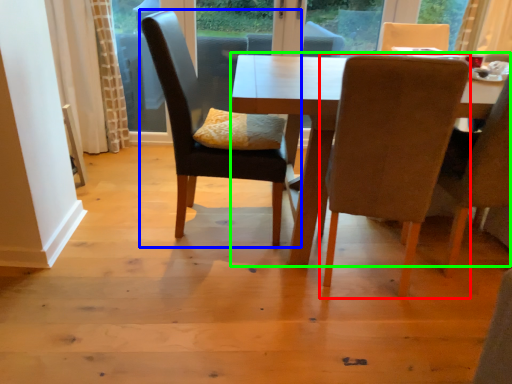
Question: Which object is positioned closest to chair (highlighted by a red box)? Select from chair (highlighted by a blue box) and kitchen & dining room table (highlighted by a green box).

Choices:
 (A) chair
 (B) kitchen & dining room table

Answer: (B)